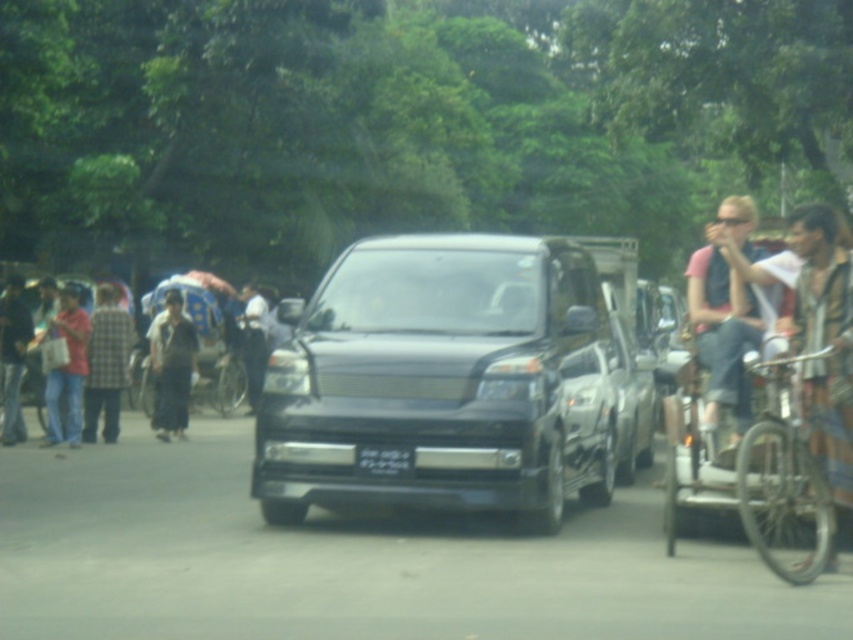
Question: Observing the image, what is the correct spatial positioning of matte pink shirt at left in reference to white fabric shirt at center?

Choices:
 (A) above
 (B) below

Answer: (B)

Question: Is shiny black suv at center bigger than dark blue jeans at left?

Choices:
 (A) no
 (B) yes

Answer: (B)

Question: Considering the real-world distances, which object is closest to the white fabric shirt at center?

Choices:
 (A) shiny black suv at center
 (B) denim jeans at right

Answer: (A)

Question: Is matte pink shirt at left to the left of black plastic license plate at center from the viewer's perspective?

Choices:
 (A) no
 (B) yes

Answer: (B)

Question: Which object is closer to the camera taking this photo?

Choices:
 (A) denim shorts at right
 (B) dark blue jeans at left
 (C) dark gray fabric pants at center
 (D) metallic silver bicycle at center

Answer: (A)

Question: Which of the following is the closest to the observer?

Choices:
 (A) (357, 452)
 (B) (703, 428)
 (C) (788, 541)

Answer: (B)